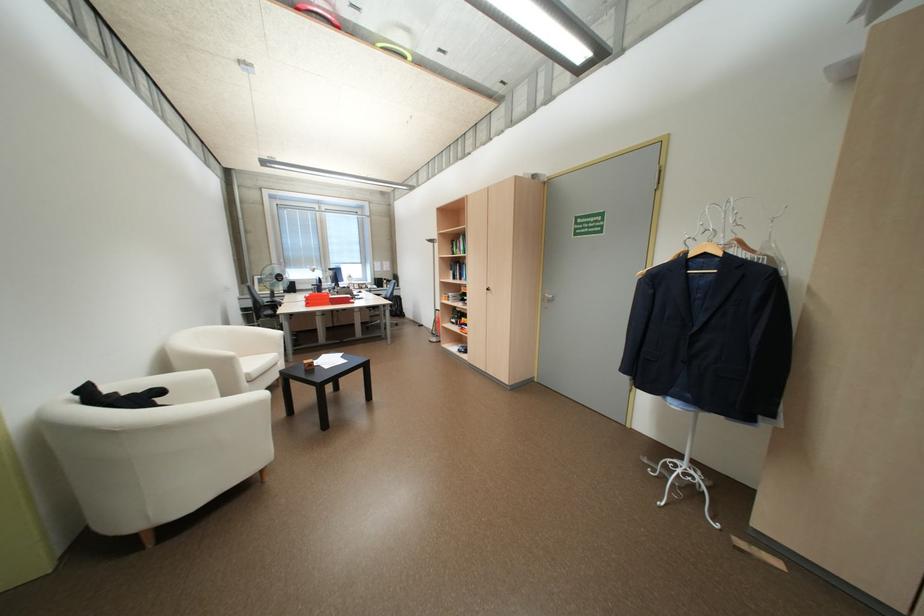
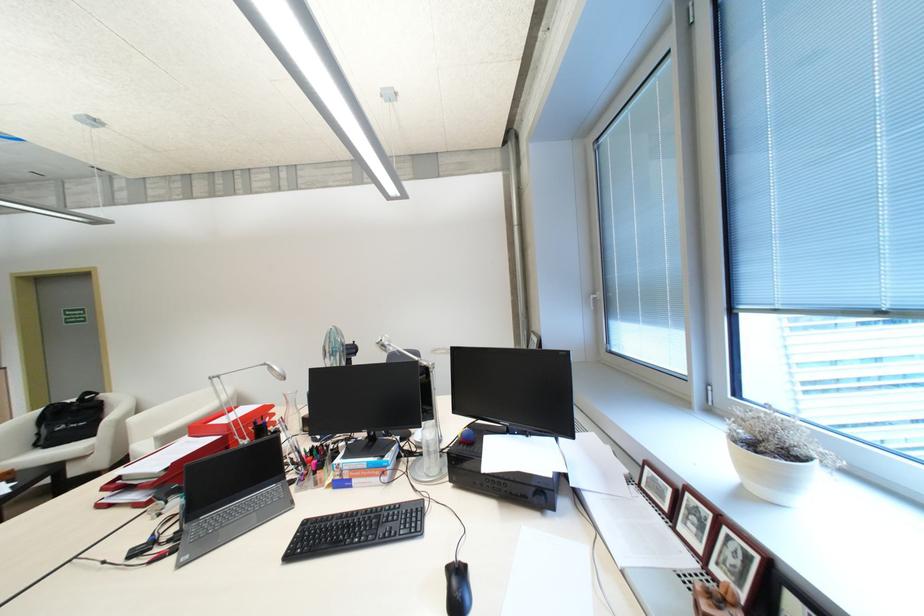
Locate, in the second image, the point that corresponds to the point at 342,296 in the first image.

(224, 439)